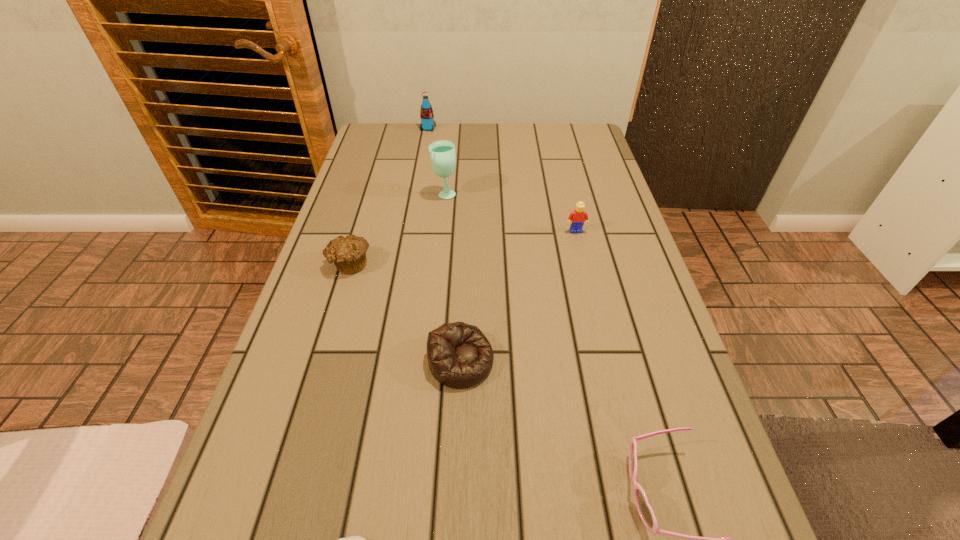
Where is `glass`? The height and width of the screenshot is (540, 960). glass is located at coordinates (442, 153).

The image size is (960, 540). Find the location of `the tallest object`. the tallest object is located at coordinates (442, 153).

You are a GUI agent. You are given a task and a screenshot of the screen. Output one action in this format:
    pyautogui.click(x=<x>, y=<y>)
    Task: Click on the soda
    
    Given the screenshot: What is the action you would take?
    pyautogui.click(x=426, y=113)

Where is `the sixth shortest object`? Image resolution: width=960 pixels, height=540 pixels. the sixth shortest object is located at coordinates (426, 113).

This screenshot has width=960, height=540. What are the coordinates of `Lego` in the screenshot? It's located at (577, 218).

You are a GUI agent. You are given a task and a screenshot of the screen. Output one action in this format:
    pyautogui.click(x=<x>, y=<y>)
    Task: Click on the fifth nearest object
    The height and width of the screenshot is (540, 960).
    Given the screenshot: What is the action you would take?
    pyautogui.click(x=577, y=218)

The height and width of the screenshot is (540, 960). I want to click on the leftmost object, so click(348, 253).

Locate an element on the screen. muffin is located at coordinates (348, 253).

Where is `the fifth farthest object`? The width and height of the screenshot is (960, 540). the fifth farthest object is located at coordinates (459, 355).

Locate an element on the screen. The image size is (960, 540). vacant point located 0.160m on the left of the tallest object is located at coordinates (375, 194).